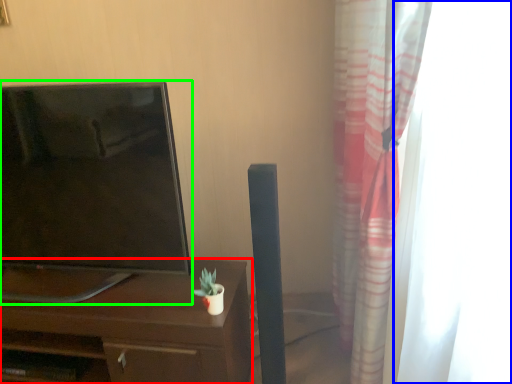
Question: Which object is the closest to the desk (highlighted by a red box)? Choose among these: glass door (highlighted by a blue box) or television (highlighted by a green box).

Choices:
 (A) glass door
 (B) television

Answer: (B)